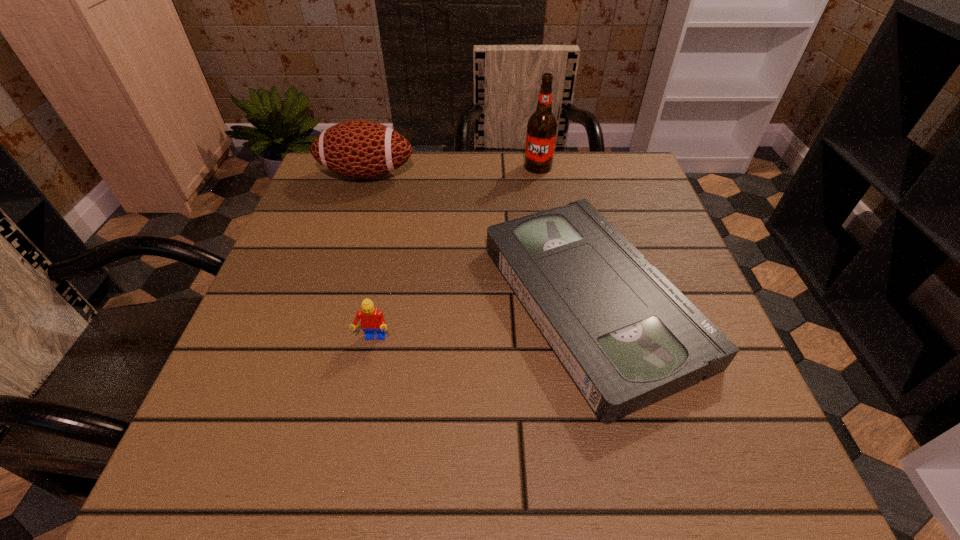
What are the coordinates of `the tallest object` in the screenshot? It's located at (542, 125).

Image resolution: width=960 pixels, height=540 pixels. I want to click on football, so click(x=360, y=149).

The width and height of the screenshot is (960, 540). Find the location of `the second shortest object`. the second shortest object is located at coordinates (372, 319).

You are a GUI agent. You are given a task and a screenshot of the screen. Output one action in this format:
    pyautogui.click(x=<x>, y=<y>)
    Task: Click on the shortest object
    Image resolution: width=960 pixels, height=540 pixels.
    Given the screenshot: What is the action you would take?
    pyautogui.click(x=627, y=337)

Find the location of `vacant point located on the left of the tallest object`. vacant point located on the left of the tallest object is located at coordinates (469, 167).

Where is `vacant space situated on the right of the football`? The width and height of the screenshot is (960, 540). vacant space situated on the right of the football is located at coordinates (555, 174).

Where is `vacant space located 0.070m on the front-facing side of the third tallest object`? vacant space located 0.070m on the front-facing side of the third tallest object is located at coordinates (364, 382).

Locate an element on the screen. The width and height of the screenshot is (960, 540). vacant point located on the back of the shortest object is located at coordinates click(x=564, y=186).

This screenshot has width=960, height=540. Find the location of `root beer present at the far edge`. root beer present at the far edge is located at coordinates (542, 125).

You are a GUI agent. You are given a task and a screenshot of the screen. Output one action in this format:
    pyautogui.click(x=<x>, y=<y>)
    Task: Click on the football located in the far edge section of the desktop
    The height and width of the screenshot is (540, 960).
    Given the screenshot: What is the action you would take?
    pyautogui.click(x=360, y=149)